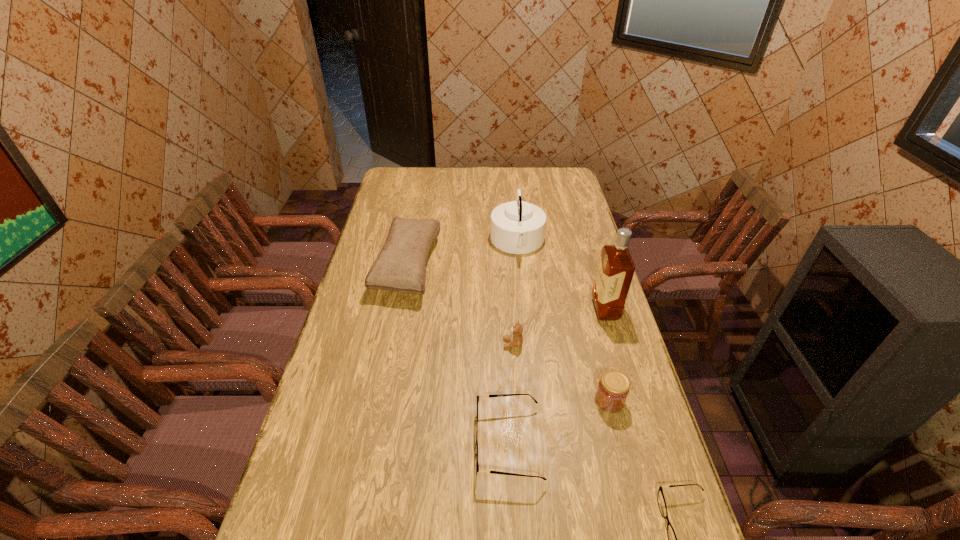
I want to click on free spot that satisfies the following two spatial constraints: 1. on the back side of the jam; 2. on the spout of the second tallest object, so click(569, 242).